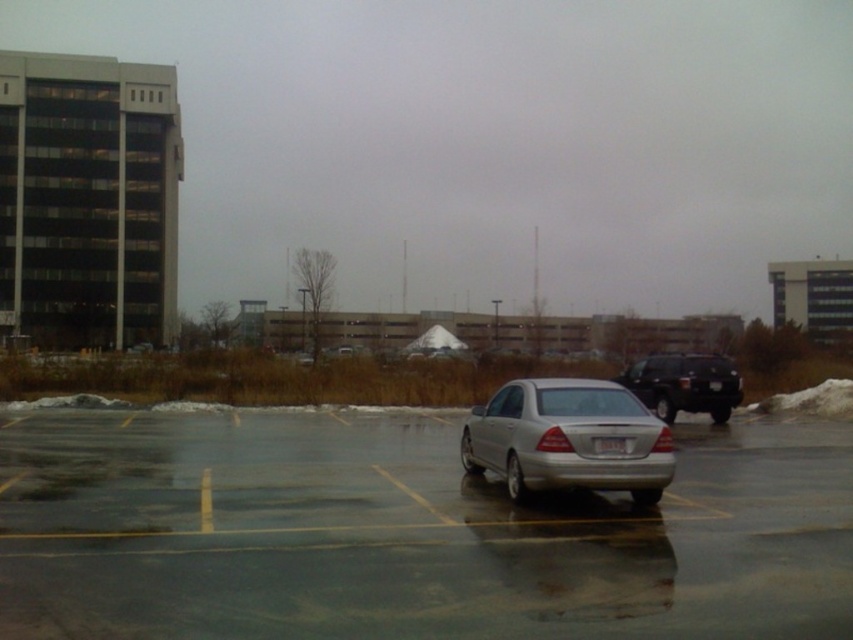
Question: Does silver metallic car at center have a lesser width compared to silver metallic sedan at center?

Choices:
 (A) no
 (B) yes

Answer: (A)

Question: Does silver metallic sedan at center appear under shiny black suv at right?

Choices:
 (A) yes
 (B) no

Answer: (A)

Question: Which of the following is the farthest from the observer?

Choices:
 (A) (498, 456)
 (B) (653, 394)
 (C) (695, 506)

Answer: (B)

Question: Can you confirm if silver metallic car at center is thinner than shiny black suv at right?

Choices:
 (A) no
 (B) yes

Answer: (A)

Question: Which point is farther to the camera?

Choices:
 (A) silver metallic car at center
 (B) shiny black suv at right
 (C) white plastic license plate at center
 (D) silver metallic sedan at center

Answer: (B)

Question: Which object is closer to the camera taking this photo?

Choices:
 (A) silver metallic car at center
 (B) shiny black suv at right
 (C) silver metallic sedan at center

Answer: (A)